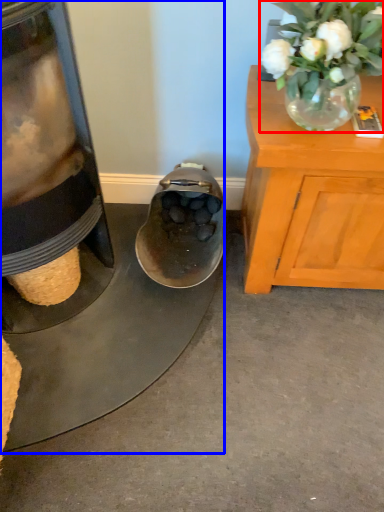
Question: Which object is closer to the camera taking this photo, floral arrangement (highlighted by a red box) or appliance (highlighted by a blue box)?

Choices:
 (A) floral arrangement
 (B) appliance

Answer: (A)